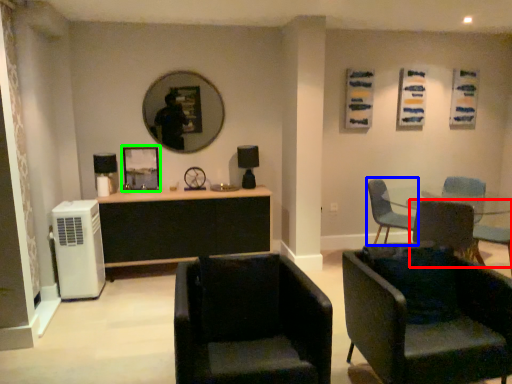
Question: Based on their relative distances, which object is farther from chair (highlighted by a red box)? Choose from chair (highlighted by a blue box) and picture frame (highlighted by a green box).

Choices:
 (A) chair
 (B) picture frame

Answer: (B)